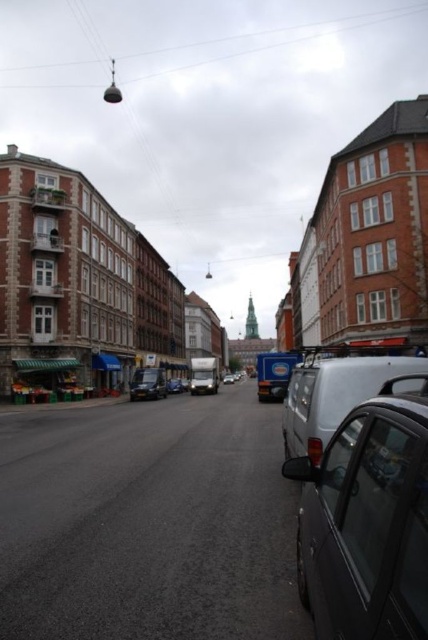
Question: Which point is farther to the camera?

Choices:
 (A) black plastic license plate at center
 (B) metallic gray car at right

Answer: (A)

Question: Is metallic silver van at center positioned before black plastic license plate at center?

Choices:
 (A) yes
 (B) no

Answer: (B)

Question: Which of these objects is positioned farthest from the metallic silver van at center?

Choices:
 (A) black plastic license plate at center
 (B) silver metallic van at center
 (C) white matte van at center-right

Answer: (B)

Question: Which point is farther from the camera taking this photo?

Choices:
 (A) (389, 388)
 (B) (228, 384)
 (C) (412, 349)

Answer: (B)

Question: Can you confirm if metallic silver van at center is thinner than black plastic license plate at center?

Choices:
 (A) no
 (B) yes

Answer: (A)

Question: Is silver metallic van at center behind black plastic license plate at center?

Choices:
 (A) yes
 (B) no

Answer: (A)